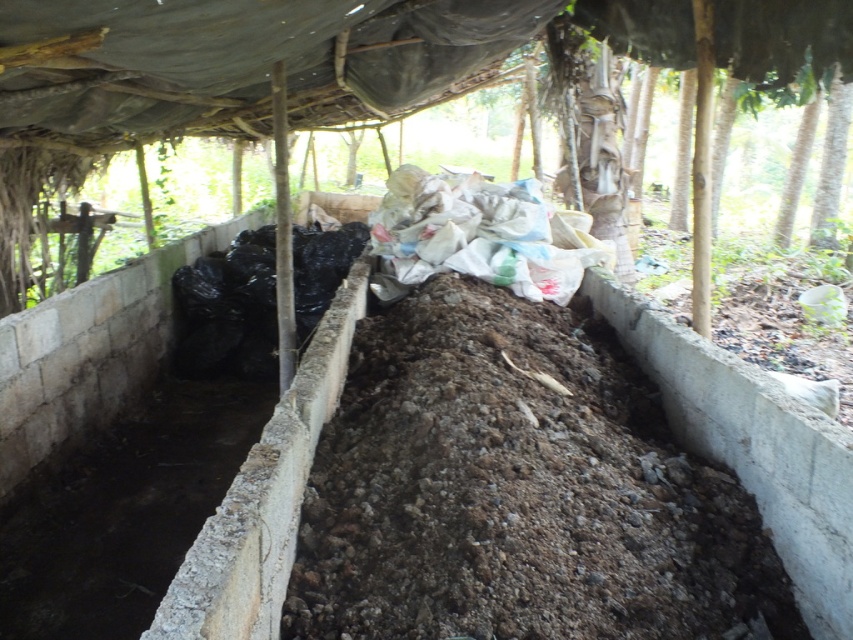
Question: Can you confirm if brown soil at center is thinner than black plastic bag at left?

Choices:
 (A) yes
 (B) no

Answer: (B)

Question: Estimate the real-world distances between objects in this image. Which object is closer to the brown soil at center?

Choices:
 (A) black plastic bag at left
 (B) white paper at center

Answer: (B)

Question: Which object is positioned closest to the white paper at center?

Choices:
 (A) black plastic bag at left
 (B) brown soil at center

Answer: (A)

Question: Is brown soil at center thinner than black plastic bag at left?

Choices:
 (A) no
 (B) yes

Answer: (A)

Question: Can you confirm if brown soil at center is positioned above black plastic bag at left?

Choices:
 (A) yes
 (B) no

Answer: (B)

Question: Based on their relative distances, which object is farther from the black plastic bag at left?

Choices:
 (A) brown soil at center
 (B) white paper at center

Answer: (A)